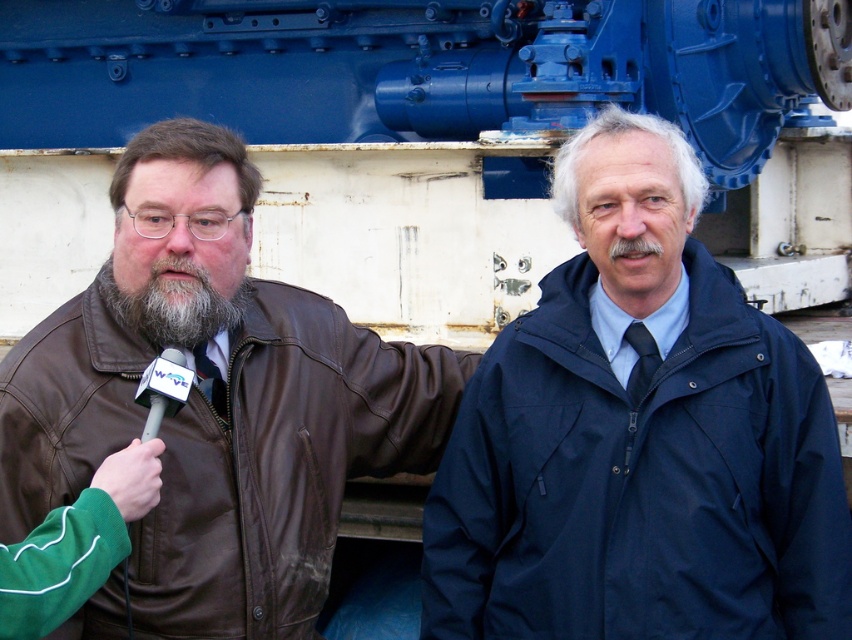
You are a photographer trying to capture a clear shot of the white plastic microphone at left and the navy blue waterproof jacket at right. Which object should you focus on first if you want to ensure both are in focus, considering their sizes?

The navy blue waterproof jacket at right might be wider than the white plastic microphone at left, so focusing on the larger navy blue waterproof jacket at right first would help ensure both are in focus.